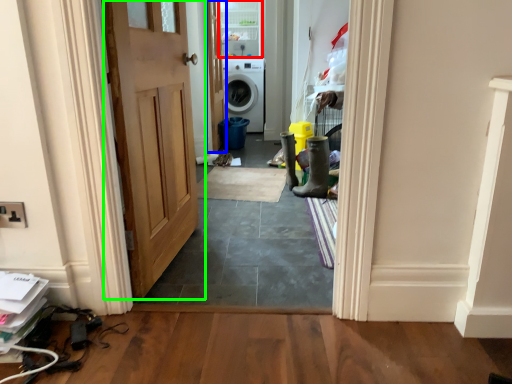
Question: Based on their relative distances, which object is farther from glass door (highlighted by a red box)? Choose from door (highlighted by a blue box) and door (highlighted by a green box).

Choices:
 (A) door
 (B) door

Answer: (B)